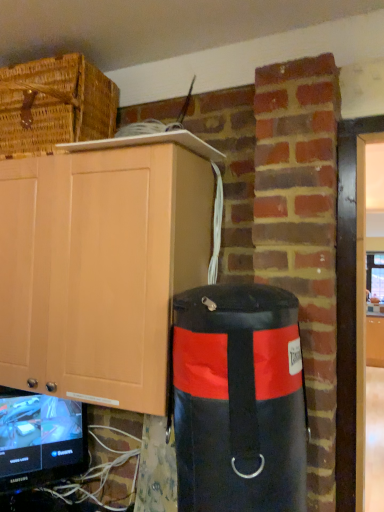
Question: From the image's perspective, relative to matte wood cabinet at upper left, which is the 1th cabinetry in left-to-right order, is woven brown basket at upper left above or below?

Choices:
 (A) above
 (B) below

Answer: (A)

Question: Is woven brown basket at upper left situated inside matte wood cabinet at upper left, arranged as the 2th cabinetry when ordered from the bottom, or outside?

Choices:
 (A) inside
 (B) outside

Answer: (B)

Question: Based on their relative distances, which object is farther from the matte wood cabinet at center, the second cabinetry from the left?

Choices:
 (A) woven brown basket at upper left
 (B) matte wood cabinet at upper left, arranged as the 2th cabinetry when ordered from the bottom
 (C) black glossy television at lower left
 (D) black leather punching bag at right

Answer: (A)

Question: Considering the real-world distances, which object is closest to the black leather punching bag at right?

Choices:
 (A) matte wood cabinet at center, acting as the 1th cabinetry starting from the right
 (B) black glossy television at lower left
 (C) woven brown basket at upper left
 (D) matte wood cabinet at upper left, which is the first cabinetry in front-to-back order

Answer: (D)